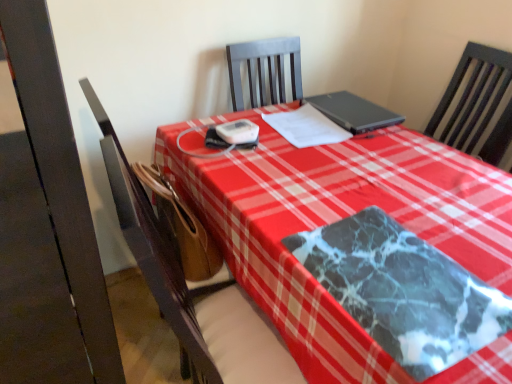
This screenshot has width=512, height=384. What do you see at coordinates (403, 291) in the screenshot? I see `marble-patterned blanket at center` at bounding box center [403, 291].

Find the location of a particular element. The image size is (512, 384). black matte laptop at center is located at coordinates (353, 112).

Between brown leather chair at center and marble-patterned blanket at center, which one is positioned in front?

marble-patterned blanket at center is more forward.

Which of these two, brown leather chair at center or marble-patterned blanket at center, is wider?

With larger width is brown leather chair at center.

What's the angular difference between brown leather chair at center and marble-patterned blanket at center's facing directions?

There is a 180-degree angle between the facing directions of brown leather chair at center and marble-patterned blanket at center.

Could you tell me if brown leather chair at center is facing marble-patterned blanket at center?

No, brown leather chair at center is not turned towards marble-patterned blanket at center.

From a real-world perspective, is white paper at center over black matte laptop at center?

No.

Does point (288, 139) lie behind point (355, 105)?

No, (288, 139) is closer to viewer.

Is white paper at center in contact with black matte laptop at center?

white paper at center and black matte laptop at center are clearly separated.

From the image's perspective, relative to black matte laptop at center, is white paper at center above or below?

white paper at center is below black matte laptop at center.

Which is nearer, [370,252] or [377,108]?

Positioned in front is point [370,252].

Which of these two, marble-patterned blanket at center or black matte laptop at center, is wider?

With larger width is black matte laptop at center.

Consider the image. Who is shorter, marble-patterned blanket at center or black matte laptop at center?

marble-patterned blanket at center is shorter.

Find the location of `laptop above the white paper at center (from a real-world perspective)`. laptop above the white paper at center (from a real-world perspective) is located at coordinates (353, 112).

How different are the orientations of black matte laptop at center and white paper at center in degrees?

The facing directions of black matte laptop at center and white paper at center are 6.88 degrees apart.

Does black matte laptop at center have a lesser width compared to white paper at center?

No.

Measure the distance from black matte laptop at center to white paper at center.

The distance of black matte laptop at center from white paper at center is 4.53 inches.

Is brown leather chair at center positioned with its back to white paper at center?

brown leather chair at center does not have its back to white paper at center.

Does brown leather chair at center touch white paper at center?

No, brown leather chair at center is not beside white paper at center.

Does point (185, 357) lie behind point (272, 114)?

No, (185, 357) is closer to viewer.

Considering the sizes of marble-patterned blanket at center and white paper at center in the image, is marble-patterned blanket at center bigger or smaller than white paper at center?

Considering their sizes, marble-patterned blanket at center takes up more space than white paper at center.

What's the angular difference between marble-patterned blanket at center and white paper at center's facing directions?

There is a 83.1-degree angle between the facing directions of marble-patterned blanket at center and white paper at center.

Is marble-patterned blanket at center far from white paper at center?

marble-patterned blanket at center is near white paper at center, not far away.

From the image's perspective, which object appears higher, marble-patterned blanket at center or white paper at center?

white paper at center.

From a real-world perspective, which object stands above the other?

In real-world perspective, marble-patterned blanket at center is above.

Is brown leather chair at center a part of marble-patterned blanket at center?

No, marble-patterned blanket at center does not contain brown leather chair at center.

Is marble-patterned blanket at center oriented towards brown leather chair at center?

No.

Can you confirm if marble-patterned blanket at center is positioned to the right of brown leather chair at center?

Correct, you'll find marble-patterned blanket at center to the right of brown leather chair at center.

Find the location of a particular element. blanket above the brown leather chair at center (from a real-world perspective) is located at coordinates (x=403, y=291).

Find the location of `laptop above the white paper at center (from the image's perspective)`. laptop above the white paper at center (from the image's perspective) is located at coordinates (353, 112).

Estimate the real-world distances between objects in this image. Which object is further from white paper at center, black matte laptop at center or brown leather chair at center?

brown leather chair at center.

Looking at the image, which one is located closer to marble-patterned blanket at center, black matte laptop at center or brown leather chair at center?

The object closer to marble-patterned blanket at center is brown leather chair at center.

Which object lies nearer to the anchor point black matte laptop at center, white paper at center or marble-patterned blanket at center?

Among the two, white paper at center is located nearer to black matte laptop at center.

Estimate the real-world distances between objects in this image. Which object is further from white paper at center, brown leather chair at center or marble-patterned blanket at center?

marble-patterned blanket at center is further to white paper at center.

From the image, which object appears to be farther from brown leather chair at center, white paper at center or marble-patterned blanket at center?

white paper at center.

Based on their spatial positions, is black matte laptop at center or white paper at center closer to marble-patterned blanket at center?

Among the two, white paper at center is located nearer to marble-patterned blanket at center.

Based on their spatial positions, is brown leather chair at center or black matte laptop at center further from marble-patterned blanket at center?

black matte laptop at center lies further to marble-patterned blanket at center than the other object.

Looking at this image, from the image, which object appears to be nearer to brown leather chair at center, black matte laptop at center or white paper at center?

white paper at center lies closer to brown leather chair at center than the other object.

Locate an element on the screen. This screenshot has width=512, height=384. chair between marble-patterned blanket at center and black matte laptop at center from front to back is located at coordinates (190, 278).

I want to click on chair between marble-patterned blanket at center and white paper at center along the z-axis, so click(x=190, y=278).

Find the location of a particular element. The width and height of the screenshot is (512, 384). notebook between brown leather chair at center and black matte laptop at center is located at coordinates (306, 127).

Locate an element on the screen. This screenshot has width=512, height=384. notebook between marble-patterned blanket at center and black matte laptop at center from front to back is located at coordinates (306, 127).